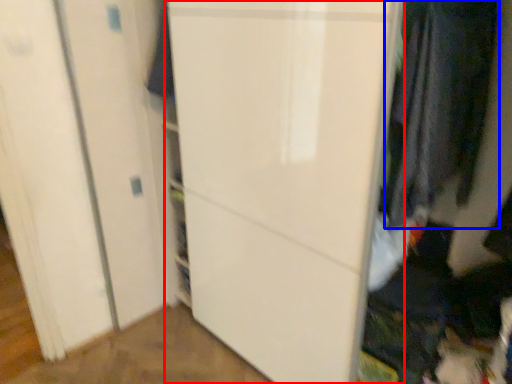
Question: Which point is further to the camera, door (highlighted by a red box) or clothing (highlighted by a blue box)?

Choices:
 (A) door
 (B) clothing

Answer: (B)